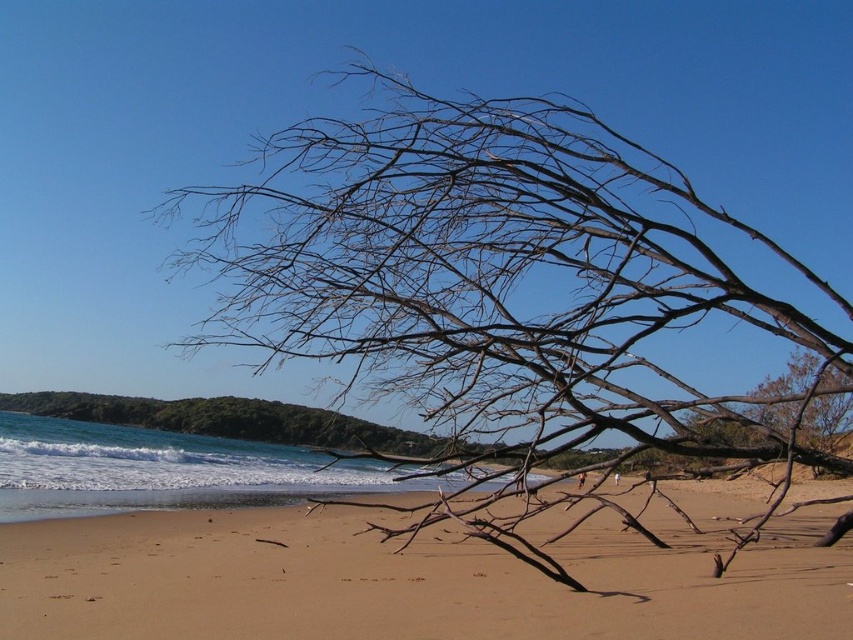
You are standing at the beach and want to reach the point marked as point (x=579, y=262). If you walk straight ahead, how far will you have to go to reach that point?

The distance between you and point (x=579, y=262) is 6.93 meters, so you will have to walk 6.93 meters straight ahead to reach it.